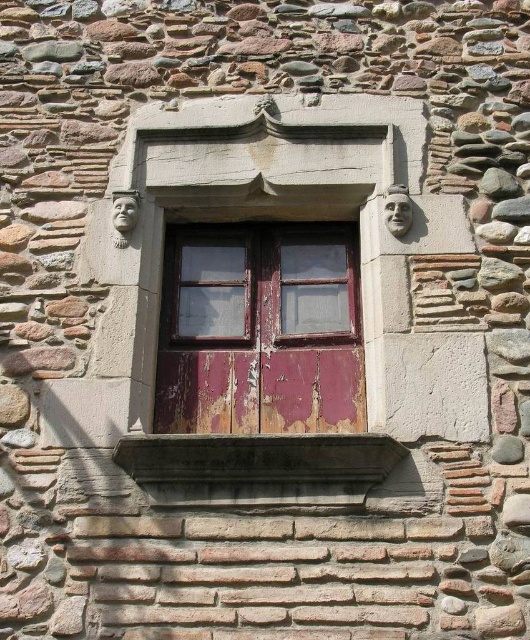
You are an architect examining a historical building. You notice a peeling paint wooden window at center. Can you determine the exact coordinates of this window on the image?

The peeling paint wooden window at center is located at coordinates point (260, 330).

In the scene shown: You are an architect examining the stone wall with a wooden window at center and a smooth stone window sill at center. Which of these two objects has a greater thickness?

The smooth stone window sill at center is thicker than the wooden window at center, as the wooden window at center is thinner than the smooth stone window sill at center.